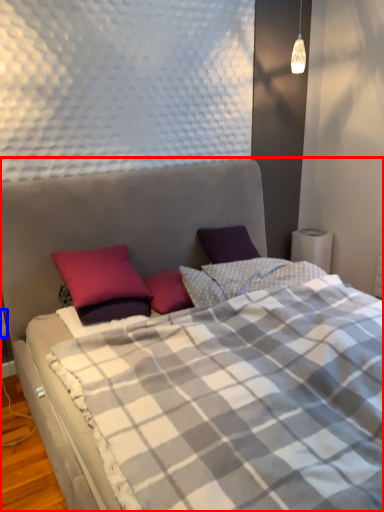
Question: Among these objects, which one is farthest to the camera, bed (highlighted by a red box) or electric outlet (highlighted by a blue box)?

Choices:
 (A) bed
 (B) electric outlet

Answer: (B)